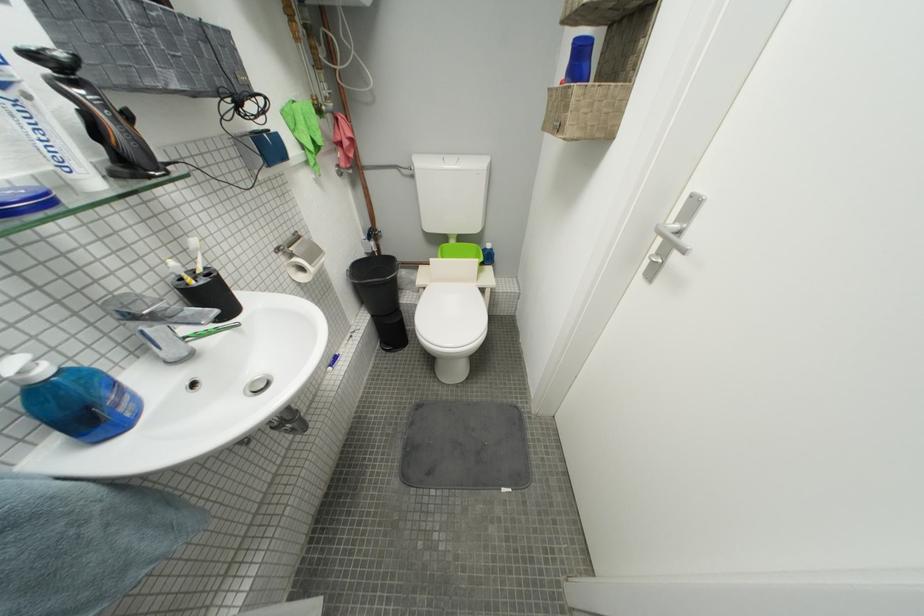
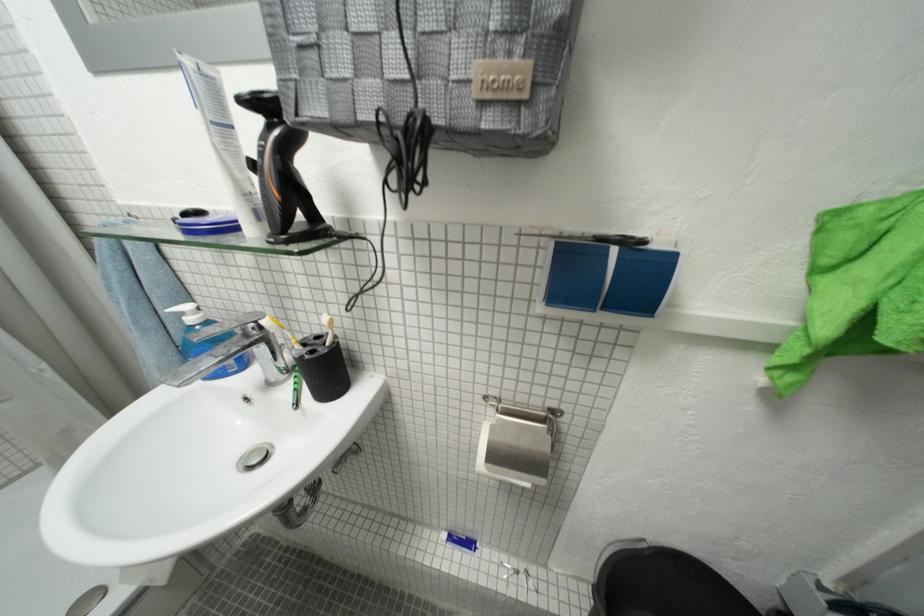
In the second image, find the point that corresponds to point (338, 371) in the first image.

(454, 538)